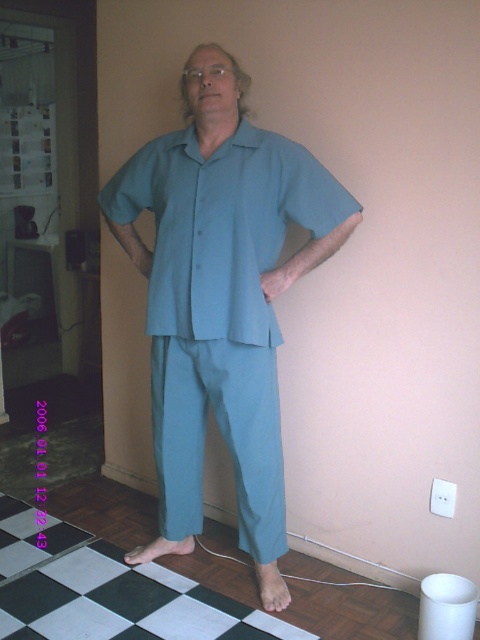
Can you confirm if teal cotton pajamas at center is bigger than teal smooth shirt at center?

Yes.

Between teal cotton pajamas at center and teal smooth shirt at center, which one appears on the right side from the viewer's perspective?

teal smooth shirt at center

Does point (122, 209) come farther from viewer compared to point (213, 204)?

Yes, point (122, 209) is behind point (213, 204).

I want to click on teal cotton pajamas at center, so click(x=220, y=298).